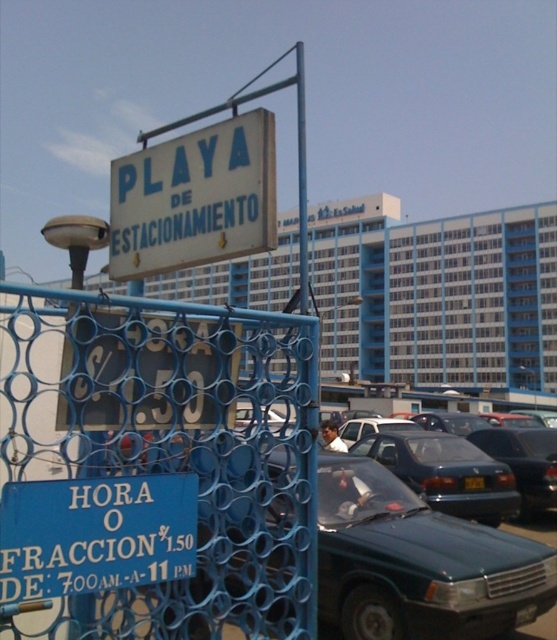
You are a tourist who just arrived at the beach and need to park your car. You see the blue plastic sign at lower left and the shiny black sedan at center. According to the parking rules displayed on the sign, what is the maximum time you can park your car here?

The sign indicates the hours of operation are from 7 AM to 11 AM, so the maximum time you can park your car here is until 11 AM.

You are a tourist trying to park your car in the parking lot. You see the blue plastic sign at lower left and the shiny black sedan at center. Which object is narrower?

The blue plastic sign at lower left is thinner than the shiny black sedan at center, so the blue plastic sign at lower left is narrower.